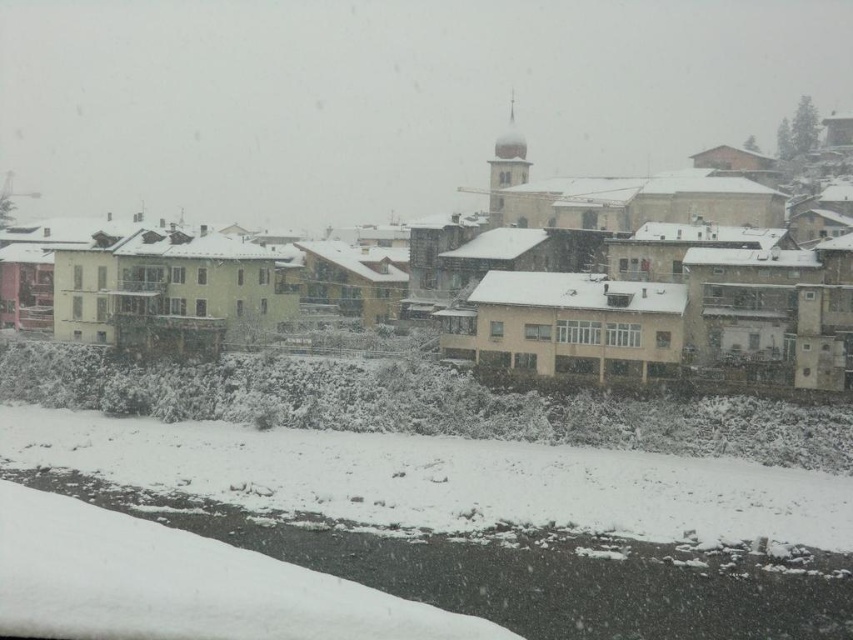
Which is in front, point (531, 500) or point (512, 160)?

Positioned in front is point (531, 500).

Does white fluffy snow at lower center appear under matte yellow building at center?

Correct, white fluffy snow at lower center is located below matte yellow building at center.

This screenshot has height=640, width=853. Describe the element at coordinates (482, 520) in the screenshot. I see `white fluffy snow at lower center` at that location.

At what (x,y) coordinates should I click in order to perform the action: click on white fluffy snow at lower center. Please return your answer as a coordinate pair (x, y). The width and height of the screenshot is (853, 640). Looking at the image, I should click on (482, 520).